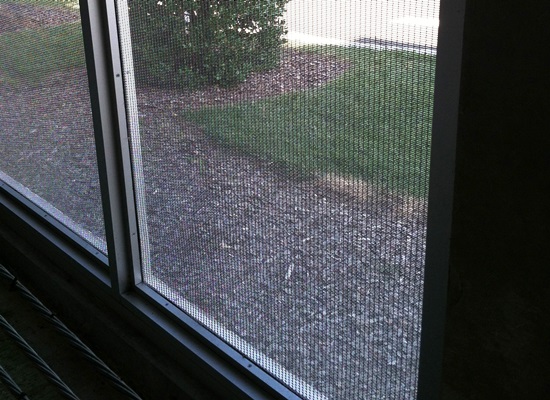
Where is `2 black window bars`? The height and width of the screenshot is (400, 550). 2 black window bars is located at coordinates (69, 242), (147, 313).